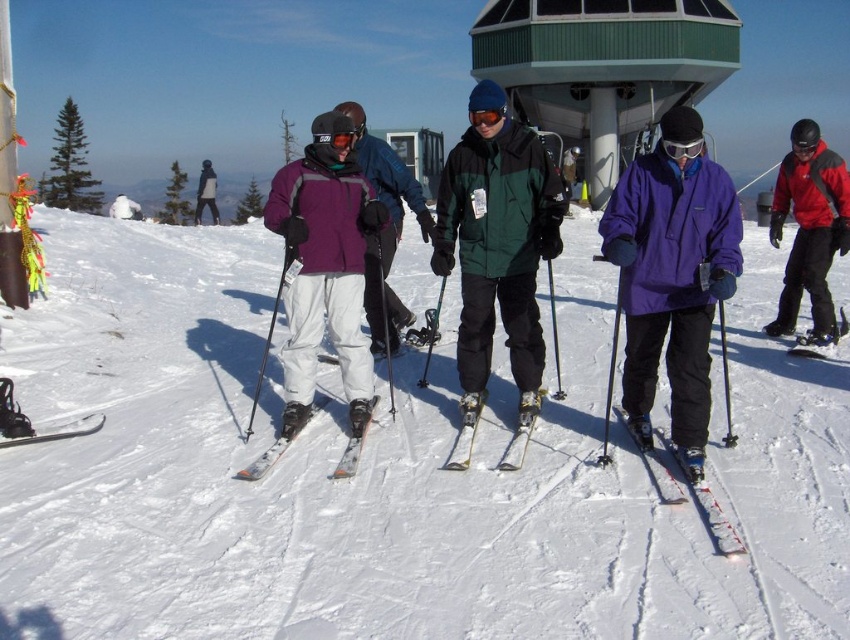
You are a photographer planning to capture a wide shot of the ski resort scene. You need to ensure that both the matte black jacket at upper left and the orange reflective goggles at center are visible in the frame. Based on their sizes, which object should you prioritize positioning closer to the camera to ensure it doesn t get lost in the composition?

The orange reflective goggles at center should be positioned closer to the camera since it is smaller in size compared to the matte black jacket at upper left, which is wider. This will help ensure the smaller object remains visible in the composition.